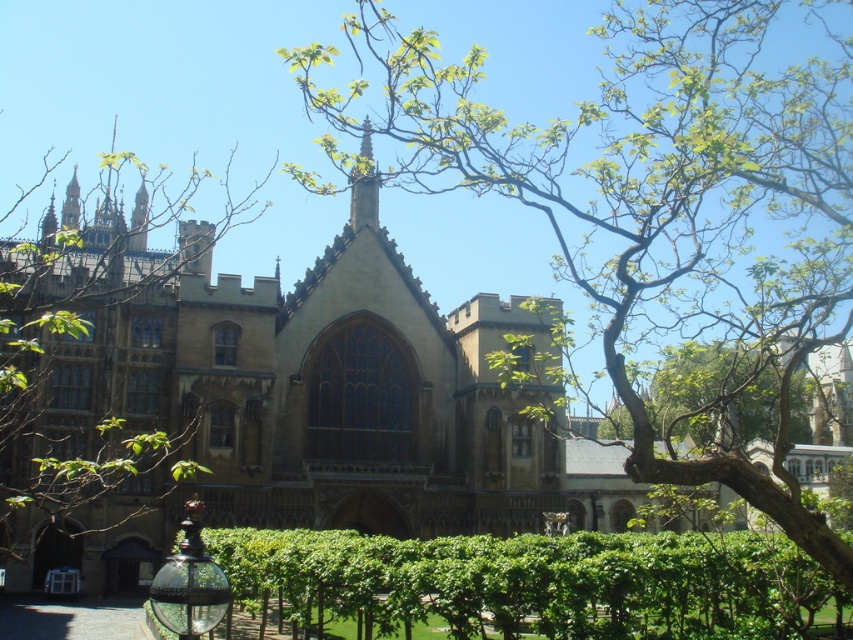
You are standing in the courtyard of the historic building and want to walk towards the entrance. There are two points marked on the path you need to cross. Which point, point (775,307) or point (804,625), is closer to you as you start walking towards the building?

Point (775,307) is closer to you because it is in front of point (804,625), meaning it lies between you and the building along your path.

You are a landscape architect designing a pathway that needs to pass between the green leafy tree at center and the green leafy hedge at center. Based on their widths, which one should you place farther from the path to avoid blocking it?

The green leafy tree at center is wider than the green leafy hedge at center. To avoid blocking the path, you should place the green leafy tree at center farther from the path since it has a greater width.